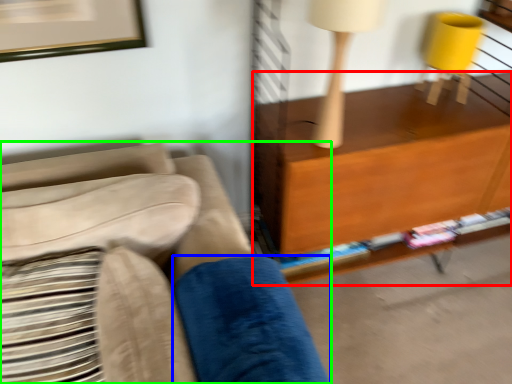
Question: Which object is positioned farthest from shelf (highlighted by a red box)? Select from pillow (highlighted by a blue box) and studio couch (highlighted by a green box).

Choices:
 (A) pillow
 (B) studio couch

Answer: (B)